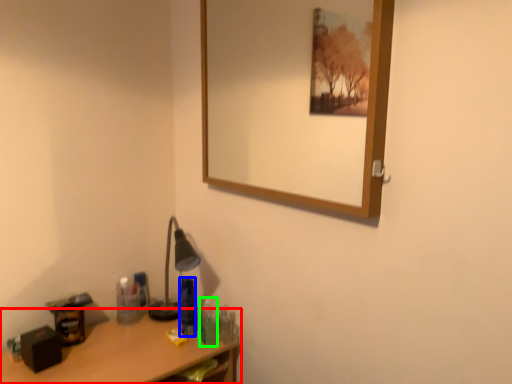
Question: Based on their relative distances, which object is nearer to desk (highlighted by a red box)? Choose from toiletry (highlighted by a blue box) and toiletry (highlighted by a green box).

Choices:
 (A) toiletry
 (B) toiletry

Answer: (A)